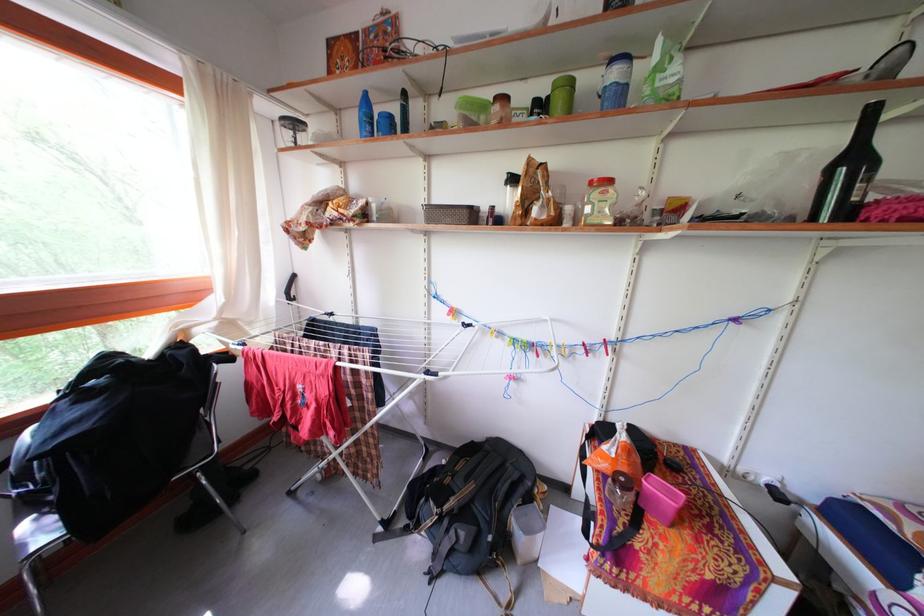
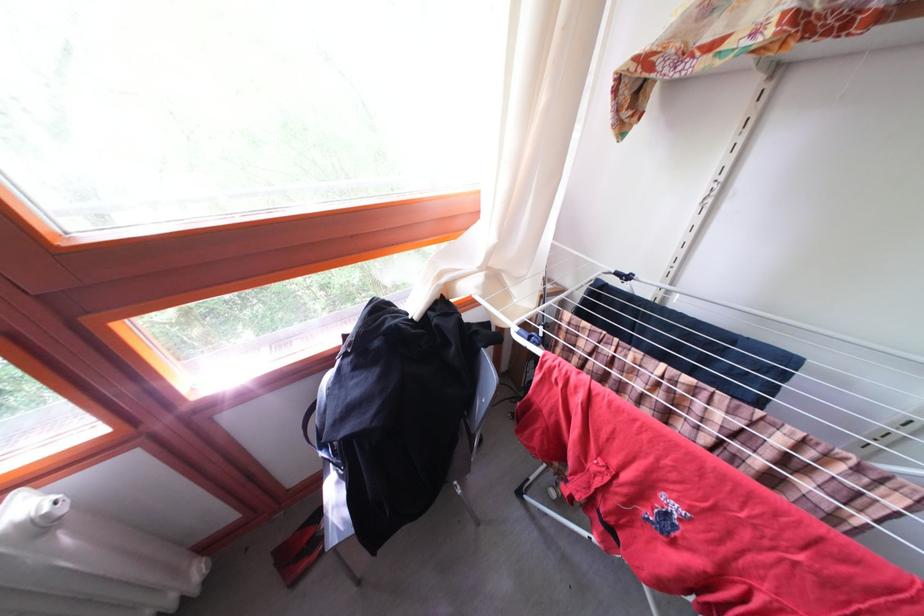
First-person continuous shooting, in which direction is the camera rotating?

The camera's rotation is toward left-down.